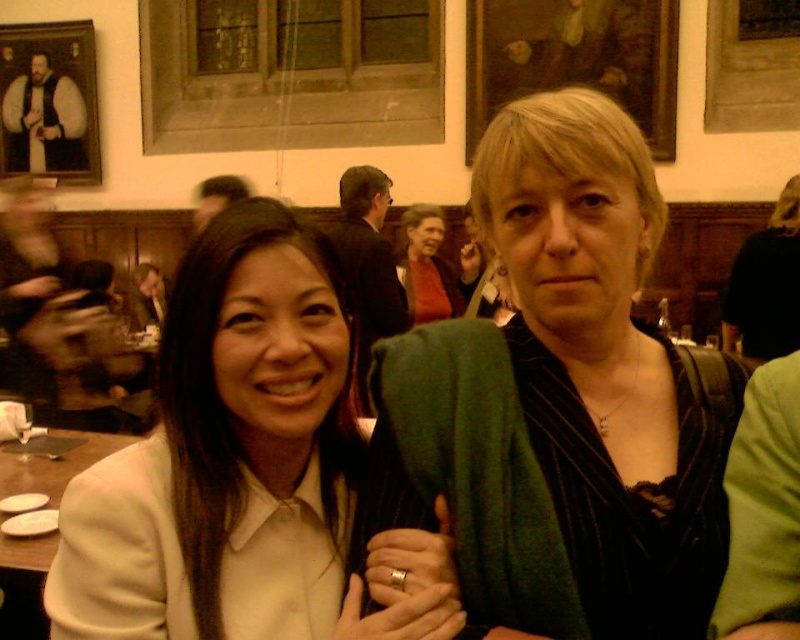
Is wooden portrait at upper left bigger than white glossy plate at lower left?

Yes.

Consider the image. Between wooden portrait at upper left and white glossy plate at lower left, which one has less height?

Standing shorter between the two is white glossy plate at lower left.

The image size is (800, 640). I want to click on wooden portrait at upper left, so click(48, 100).

Does matte green sweater at center have a smaller size compared to white glossy plate at lower left?

No, matte green sweater at center is not smaller than white glossy plate at lower left.

Is matte green sweater at center positioned behind white glossy plate at lower left?

No, matte green sweater at center is closer to the viewer.

Does point (514, 460) come farther from viewer compared to point (82, 448)?

No, it is in front of (82, 448).

Identify the location of matte green sweater at center. This screenshot has width=800, height=640. (562, 401).

In the scene shown: Does matte white blouse at center have a lesser width compared to white glossy plate at lower left?

Yes.

Can you confirm if matte white blouse at center is positioned above white glossy plate at lower left?

Indeed, matte white blouse at center is positioned over white glossy plate at lower left.

Where is `matte white blouse at center`? This screenshot has height=640, width=800. matte white blouse at center is located at coordinates (236, 465).

This screenshot has width=800, height=640. Find the location of `matte white blouse at center`. matte white blouse at center is located at coordinates (236, 465).